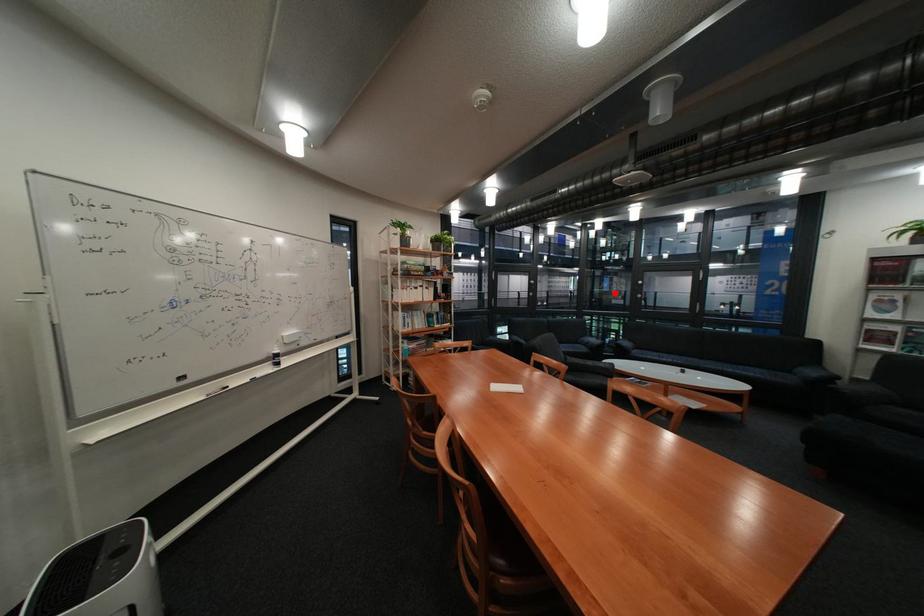
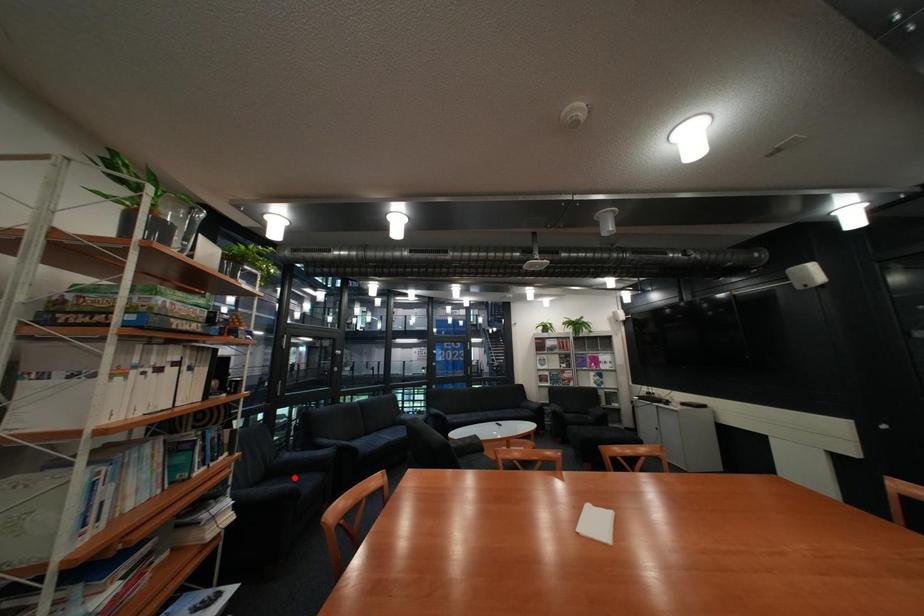
I am providing you with two images of the same scene from different viewpoints. A red point is marked on the first image and another point is marked on the second image. Is the marked point in image1 the same physical position as the marked point in image2?

No